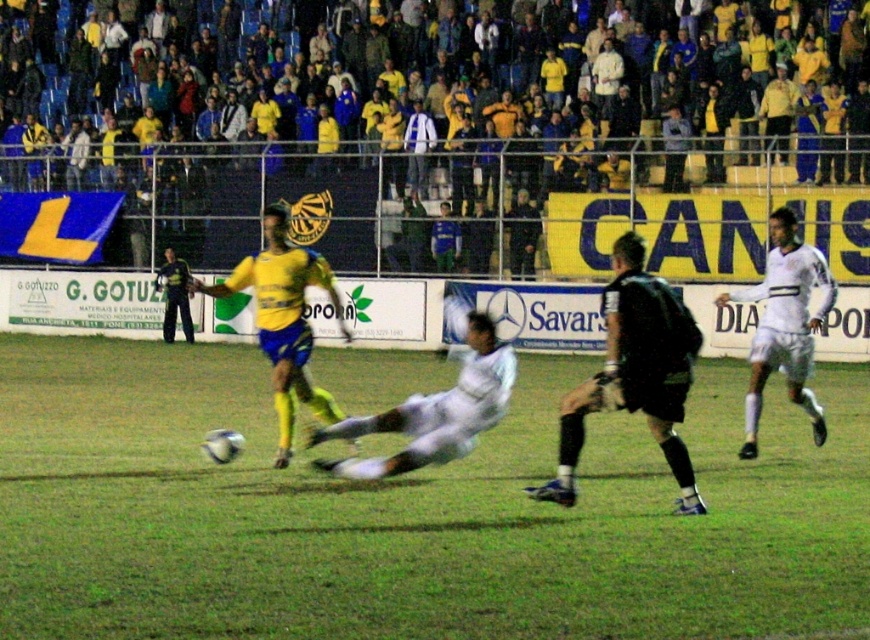
You are a soccer coach analyzing the game footage. You notice two players in the frame wearing a yellow matte jersey at center and a white matte jersey at right. Based on their jersey sizes, which player might have a smaller playing position on the field?

The yellow matte jersey at center has a smaller width than the white matte jersey at right, indicating that the player in the yellow matte jersey at center might have a smaller playing position on the field.